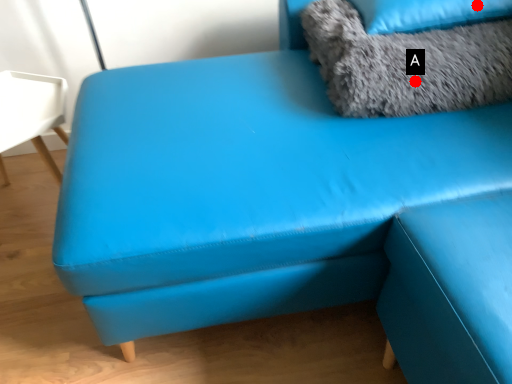
Question: Two points are circled on the image, labeled by A and B beside each circle. Which of the following is the farthest from the observer?

Choices:
 (A) A is further
 (B) B is further

Answer: (B)